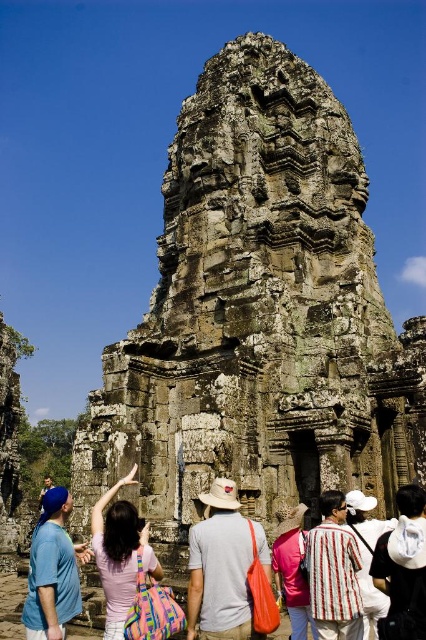
Question: Among these objects, which one is nearest to the camera?

Choices:
 (A) striped fabric shirt at center
 (B) white cotton backpack at center
 (C) matte blue shirt at lower left
 (D) blue denim jeans at lower left

Answer: (B)

Question: Among these points, which one is nearest to the camera?

Choices:
 (A) (213, 586)
 (B) (389, 528)
 (C) (100, 538)
 (D) (290, 390)

Answer: (A)

Question: Estimate the real-world distances between objects in this image. Which object is closer to the blue denim jeans at lower left?

Choices:
 (A) carved stone temple at center
 (B) matte blue shirt at lower left
 (C) white cotton backpack at center

Answer: (A)

Question: Is carved stone temple at center above matte blue shirt at lower left?

Choices:
 (A) no
 (B) yes

Answer: (B)

Question: Is the position of carved stone temple at center less distant than that of gray fabric hat at center?

Choices:
 (A) no
 (B) yes

Answer: (A)

Question: Is striped fabric shirt at center bigger than striped cotton shirt at center?

Choices:
 (A) yes
 (B) no

Answer: (B)